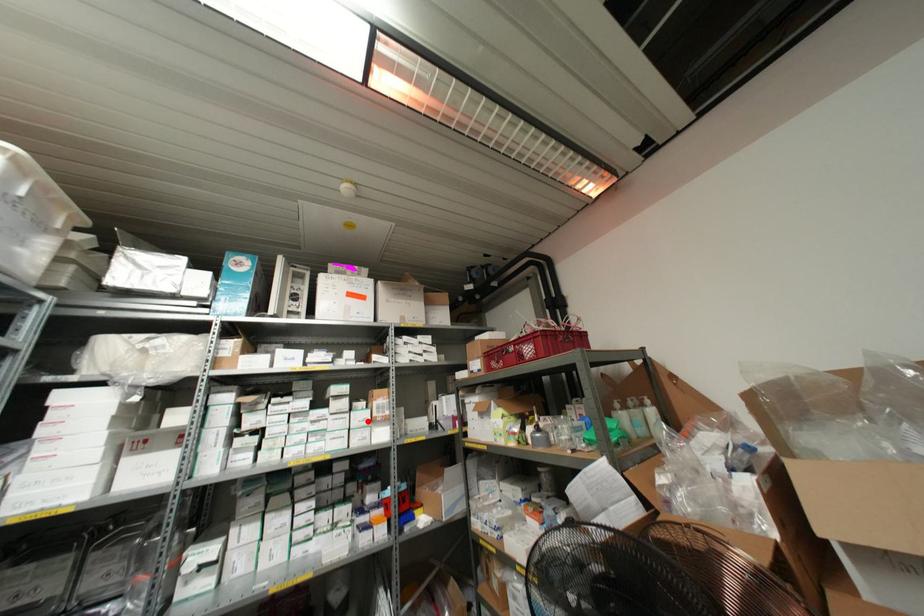
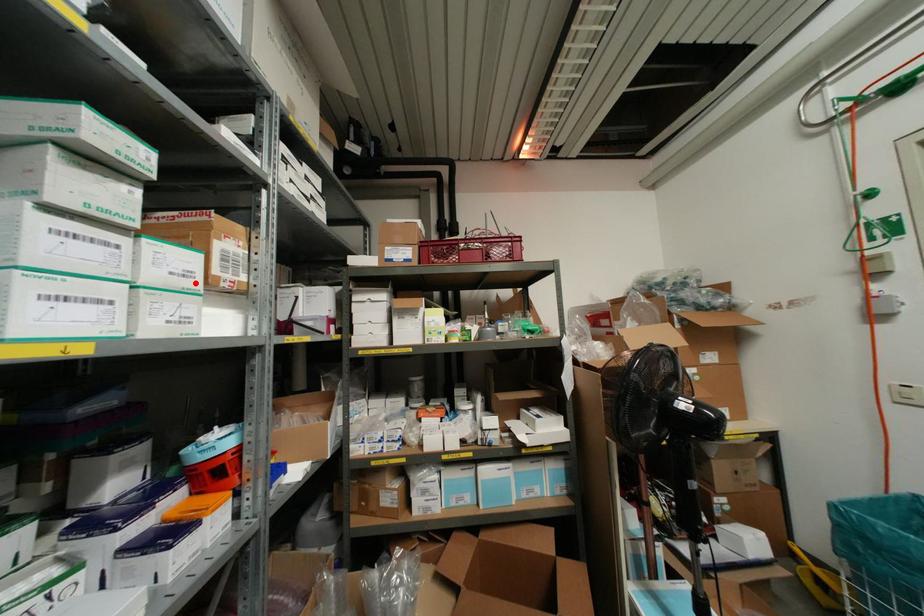
Consider the image. I am providing you with two images of the same scene from different viewpoints. A red point is marked on the first image and another point is marked on the second image. Is the red point in image1 aligned with the point shown in image2?

Yes